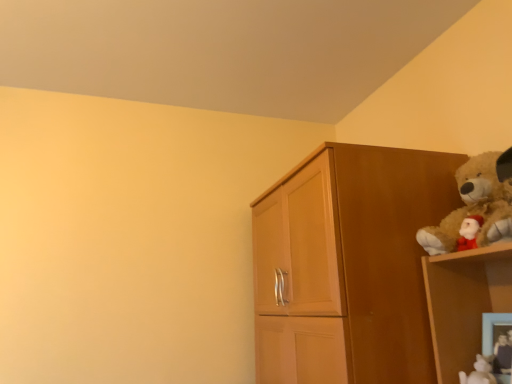
Question: Are wooden cupboard at right and velvety plush bear at upper right, the second toy in the left-to-right sequence, making contact?

Choices:
 (A) yes
 (B) no

Answer: (B)

Question: Considering the relative sizes of wooden cupboard at right and velvety plush bear at upper right, the second toy in the left-to-right sequence, in the image provided, is wooden cupboard at right shorter than velvety plush bear at upper right, the second toy in the left-to-right sequence,?

Choices:
 (A) yes
 (B) no

Answer: (B)

Question: Is wooden cupboard at right further to the viewer compared to velvety plush bear at upper right, acting as the first toy starting from the right?

Choices:
 (A) yes
 (B) no

Answer: (A)

Question: From the image's perspective, is wooden cupboard at right located beneath velvety plush bear at upper right, acting as the first toy starting from the right?

Choices:
 (A) no
 (B) yes

Answer: (A)

Question: Is wooden cupboard at right taller than velvety plush bear at upper right, the second toy in the left-to-right sequence?

Choices:
 (A) no
 (B) yes

Answer: (B)

Question: Which is correct: fuzzy brown teddy bear at upper right is inside wooden picture frame at lower right, or outside of it?

Choices:
 (A) outside
 (B) inside

Answer: (A)

Question: In terms of height, does fuzzy brown teddy bear at upper right look taller or shorter compared to wooden picture frame at lower right?

Choices:
 (A) tall
 (B) short

Answer: (A)

Question: In the image, is fuzzy brown teddy bear at upper right positioned in front of or behind wooden picture frame at lower right?

Choices:
 (A) behind
 (B) front

Answer: (B)

Question: Is point (488, 238) closer or farther from the camera than point (492, 349)?

Choices:
 (A) farther
 (B) closer

Answer: (B)

Question: In terms of height, does white glossy figurine at lower right, the 2th toy positioned from the right, look taller or shorter compared to velvety plush bear at upper right, acting as the first toy starting from the right?

Choices:
 (A) short
 (B) tall

Answer: (A)

Question: Considering the positions of white glossy figurine at lower right, the first toy viewed from the left, and velvety plush bear at upper right, acting as the first toy starting from the right, in the image, is white glossy figurine at lower right, the first toy viewed from the left, bigger or smaller than velvety plush bear at upper right, acting as the first toy starting from the right,?

Choices:
 (A) small
 (B) big

Answer: (A)

Question: In the image, is white glossy figurine at lower right, the 2th toy positioned from the right, positioned in front of or behind velvety plush bear at upper right, acting as the first toy starting from the right?

Choices:
 (A) front
 (B) behind

Answer: (B)

Question: Is point (482, 362) positioned closer to the camera than point (507, 372)?

Choices:
 (A) farther
 (B) closer

Answer: (A)

Question: Considering the positions of fuzzy brown teddy bear at upper right and white glossy figurine at lower right, the 2th toy positioned from the right, in the image, is fuzzy brown teddy bear at upper right wider or thinner than white glossy figurine at lower right, the 2th toy positioned from the right,?

Choices:
 (A) wide
 (B) thin

Answer: (A)

Question: Based on their positions, is fuzzy brown teddy bear at upper right located to the left or right of white glossy figurine at lower right, the 2th toy positioned from the right?

Choices:
 (A) left
 (B) right

Answer: (B)